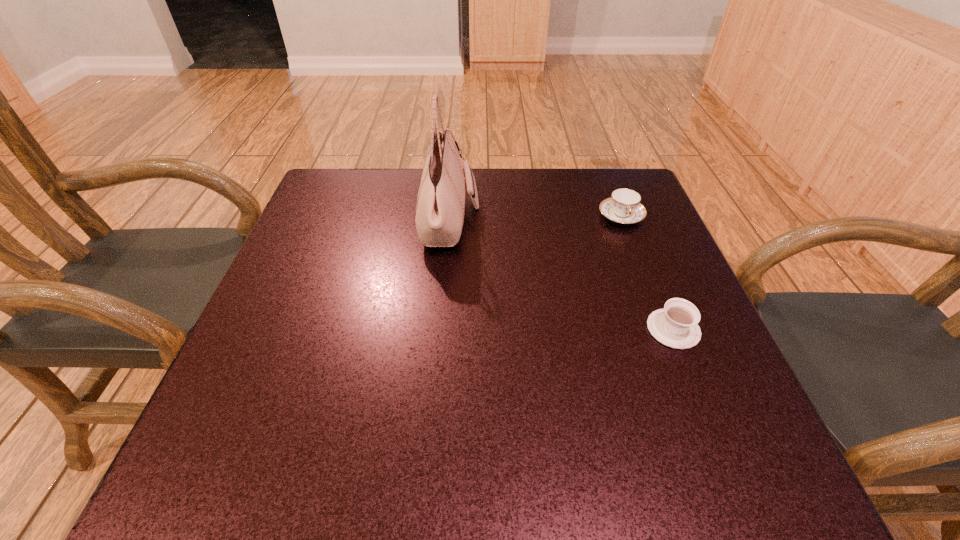
Locate an element on the screen. The image size is (960, 540). vacant point located between the leftmost object and the farther teacup is located at coordinates (536, 218).

This screenshot has height=540, width=960. Find the location of `unoccupied area between the farther teacup and the nearer teacup`. unoccupied area between the farther teacup and the nearer teacup is located at coordinates (647, 273).

Locate an element on the screen. vacant space in between the tallest object and the farther teacup is located at coordinates (536, 218).

You are a GUI agent. You are given a task and a screenshot of the screen. Output one action in this format:
    pyautogui.click(x=<x>, y=<y>)
    Task: Click on the vacant point located between the farther teacup and the handbag
    The height and width of the screenshot is (540, 960).
    Given the screenshot: What is the action you would take?
    pyautogui.click(x=536, y=218)

Find the location of a particular element. The image size is (960, 540). empty space that is in between the farther teacup and the shortest object is located at coordinates (647, 273).

Locate an element on the screen. The width and height of the screenshot is (960, 540). vacant area that lies between the farther teacup and the leftmost object is located at coordinates (536, 218).

This screenshot has height=540, width=960. Find the location of `vacant space that's between the farther teacup and the leftmost object`. vacant space that's between the farther teacup and the leftmost object is located at coordinates (536, 218).

Locate an element on the screen. Image resolution: width=960 pixels, height=540 pixels. vacant region between the leftmost object and the farther teacup is located at coordinates tap(536, 218).

The height and width of the screenshot is (540, 960). I want to click on vacant area between the leftmost object and the farther teacup, so click(x=536, y=218).

Identify the location of the closest object to the shorter teacup. (624, 206).